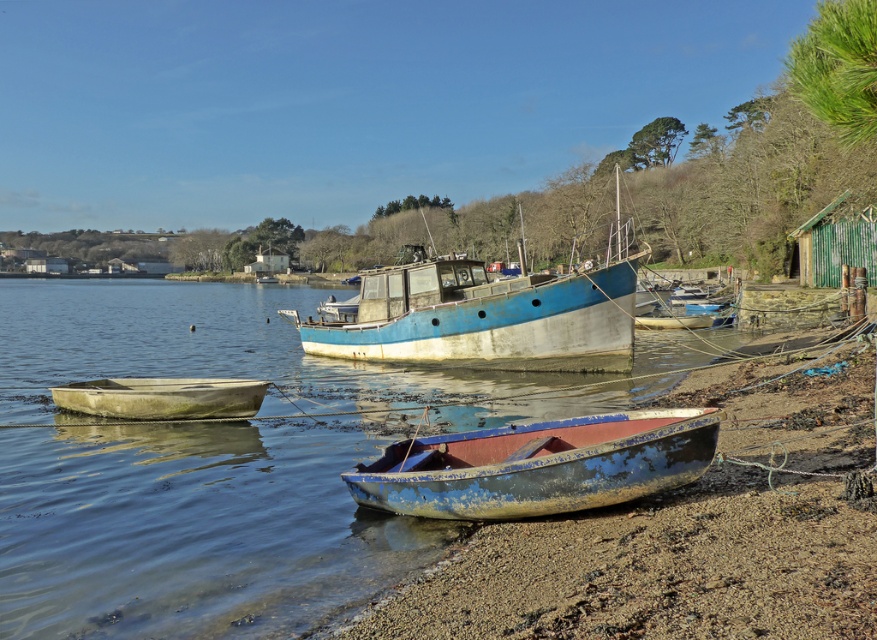
Does point (526, 284) lie behind point (168, 403)?

Yes.

Does point (544, 339) come in front of point (120, 385)?

No, (544, 339) is behind (120, 385).

Between point (546, 321) and point (88, 392), which one is positioned in front?

Positioned in front is point (88, 392).

Locate an element on the screen. blue weathered boat at center is located at coordinates (481, 316).

Which of these two, blue weathered boat at center or blue weathered canoe at lower center, stands taller?

blue weathered boat at center is taller.

Between blue weathered boat at center and blue weathered canoe at lower center, which one has less height?

blue weathered canoe at lower center is shorter.

This screenshot has width=877, height=640. I want to click on blue weathered boat at center, so click(481, 316).

In the scene shown: Who is more forward, [350,477] or [196,401]?

Point [350,477] is more forward.

Measure the distance between blue weathered canoe at lower center and white weathered canoe at lower left.

They are 6.45 meters apart.

Describe the element at coordinates (539, 465) in the screenshot. I see `blue weathered canoe at lower center` at that location.

Locate an element on the screen. blue weathered canoe at lower center is located at coordinates (539, 465).